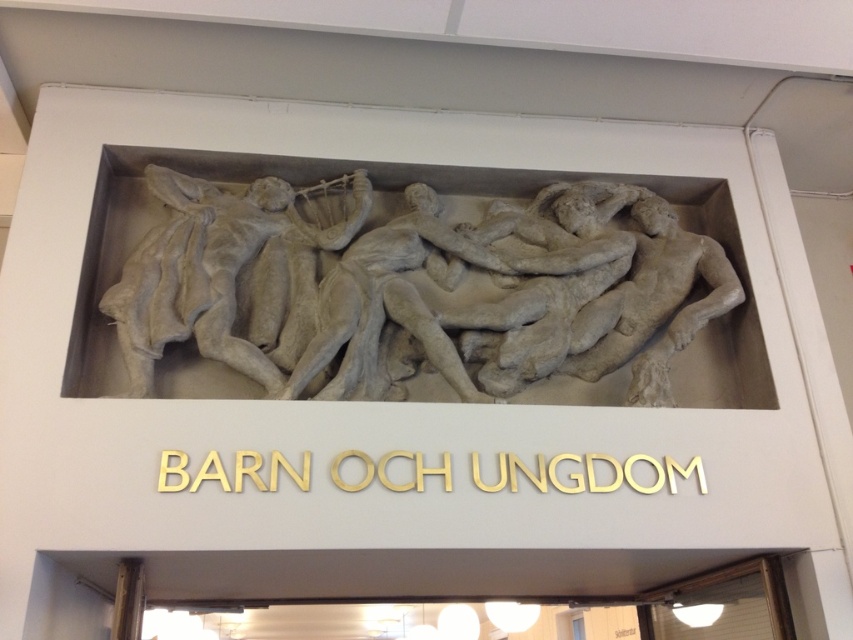
In the scene shown: Is white stone relief at center positioned before gray stone sculpture at center?

No, white stone relief at center is further to the viewer.

Who is more distant from viewer, (538, 221) or (189, 268)?

Point (538, 221)

Where is `white stone relief at center`? The height and width of the screenshot is (640, 853). white stone relief at center is located at coordinates (413, 291).